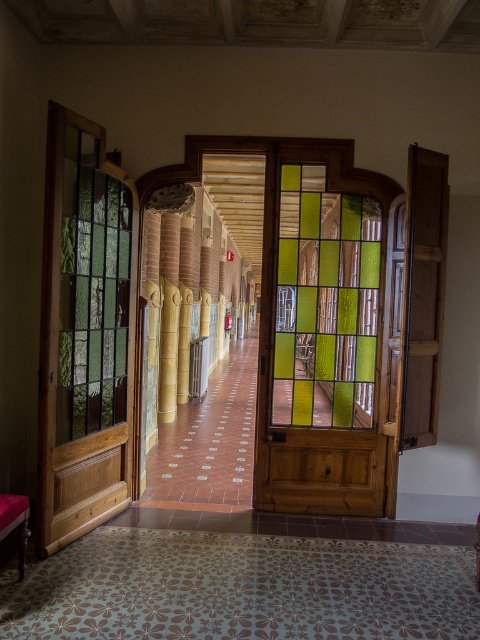
Question: Is stained glass door at left below green stained glass at center?

Choices:
 (A) no
 (B) yes

Answer: (B)

Question: Based on their relative distances, which object is farther from the green stained glass at center?

Choices:
 (A) green stained glass at left
 (B) stained glass door at left

Answer: (B)

Question: Is stained glass door at left further to the viewer compared to green stained glass at center?

Choices:
 (A) no
 (B) yes

Answer: (A)

Question: Is stained glass door at left thinner than green stained glass at center?

Choices:
 (A) yes
 (B) no

Answer: (A)

Question: Among these objects, which one is nearest to the camera?

Choices:
 (A) green stained glass at left
 (B) green stained glass at center
 (C) stained glass door at left

Answer: (C)

Question: Among these objects, which one is nearest to the camera?

Choices:
 (A) green stained glass at left
 (B) green stained glass at center
 (C) stained glass door at left

Answer: (C)